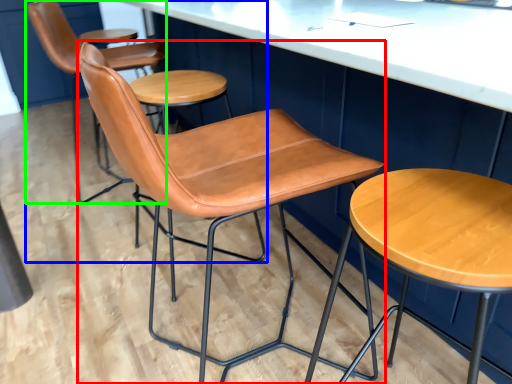
Question: Which object is the farthest from chair (highlighted by a red box)? Choose among these: chair (highlighted by a blue box) or chair (highlighted by a green box).

Choices:
 (A) chair
 (B) chair

Answer: (B)